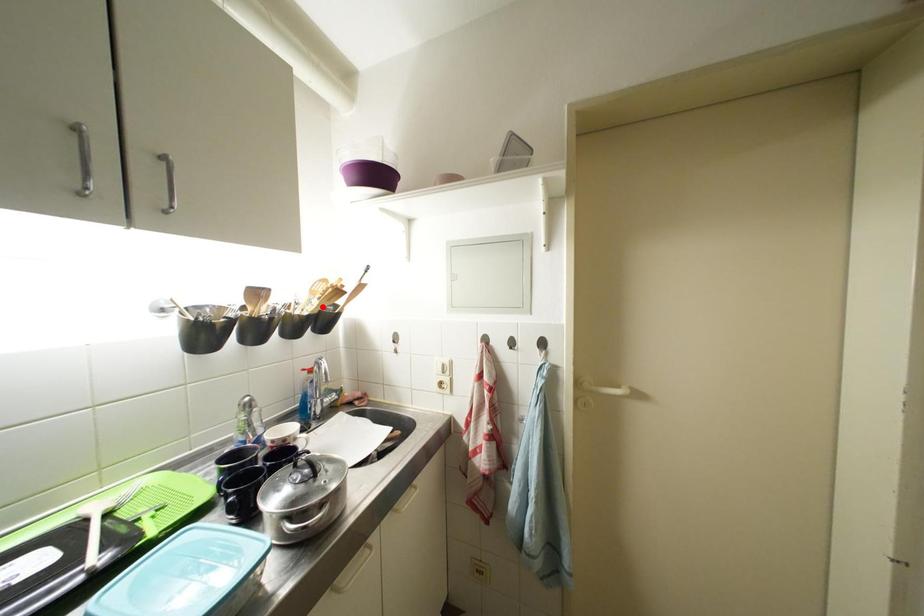
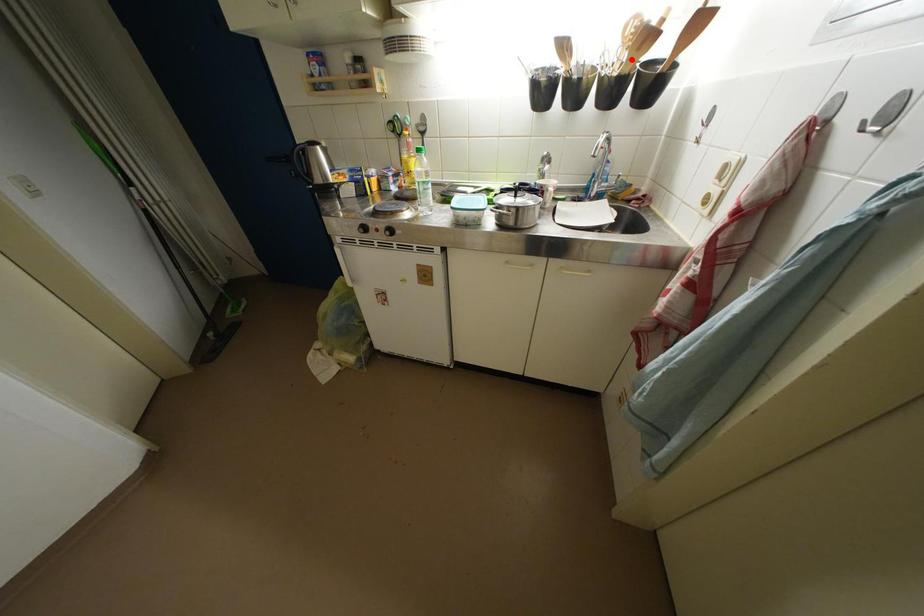
I am providing you with two images of the same scene from different viewpoints. A red point is marked on the first image and another point is marked on the second image. Are the points marked in image1 and image2 representing the same 3D position?

Yes